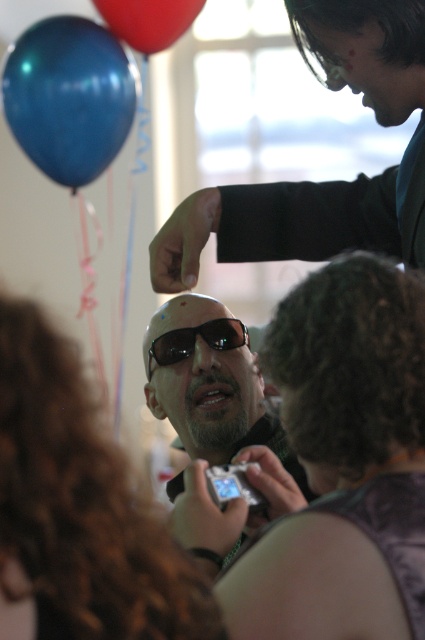
Question: Among these objects, which one is farthest from the camera?

Choices:
 (A) shiny blue balloon at upper left
 (B) sunglasses at center
 (C) shiny black sunglasses at upper center
 (D) black matte sunglasses at center

Answer: (A)

Question: Which point is farther to the camera?

Choices:
 (A) matte purple tank top at center
 (B) sunglasses at center
 (C) shiny black sunglasses at upper center

Answer: (B)

Question: Is the position of shiny black sunglasses at upper center less distant than that of shiny blue balloon at upper left?

Choices:
 (A) no
 (B) yes

Answer: (B)

Question: Does shiny black sunglasses at upper center appear on the right side of black matte sunglasses at center?

Choices:
 (A) yes
 (B) no

Answer: (A)

Question: Does sunglasses at center have a smaller size compared to black matte sunglasses at center?

Choices:
 (A) no
 (B) yes

Answer: (A)

Question: Which of the following is the closest to the observer?

Choices:
 (A) matte purple tank top at center
 (B) shiny black sunglasses at upper center

Answer: (A)